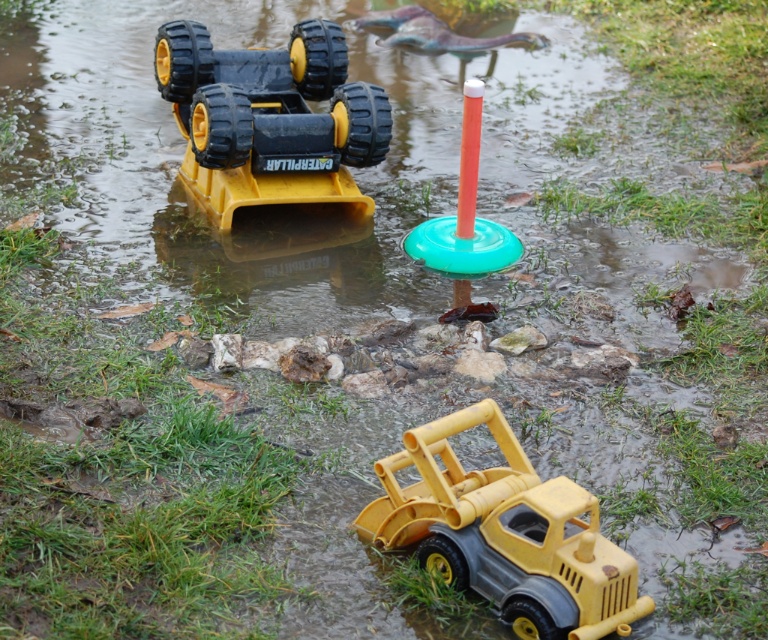
Who is higher up, yellow plastic toy truck at lower center or green plastic ring at center?

green plastic ring at center

Is yellow plastic toy truck at lower center shorter than green plastic ring at center?

Indeed, yellow plastic toy truck at lower center has a lesser height compared to green plastic ring at center.

At what (x,y) coordinates should I click in order to perform the action: click on yellow plastic toy truck at lower center. Please return your answer as a coordinate pair (x, y). This screenshot has height=640, width=768. Looking at the image, I should click on (505, 532).

Locate an element on the screen. yellow plastic toy truck at lower center is located at coordinates (505, 532).

Does yellow plastic toy truck at lower center have a lesser width compared to matte black caterpillar truck at upper left?

Indeed, yellow plastic toy truck at lower center has a lesser width compared to matte black caterpillar truck at upper left.

Image resolution: width=768 pixels, height=640 pixels. I want to click on yellow plastic toy truck at lower center, so click(x=505, y=532).

Who is more forward, (392,484) or (339,147)?

Point (392,484)

You are a GUI agent. You are given a task and a screenshot of the screen. Output one action in this format:
    pyautogui.click(x=<x>, y=<y>)
    Task: Click on the yellow plastic toy truck at lower center
    This screenshot has height=640, width=768.
    Given the screenshot: What is the action you would take?
    pyautogui.click(x=505, y=532)

Is point (277, 164) in front of point (482, 253)?

No, (277, 164) is behind (482, 253).

Is matte black caterpillar truck at upper left below green plastic ring at center?

Incorrect, matte black caterpillar truck at upper left is not positioned below green plastic ring at center.

Between point (164, 52) and point (480, 259), which one is positioned in front?

Point (480, 259) is in front.

The height and width of the screenshot is (640, 768). I want to click on matte black caterpillar truck at upper left, so click(270, 118).